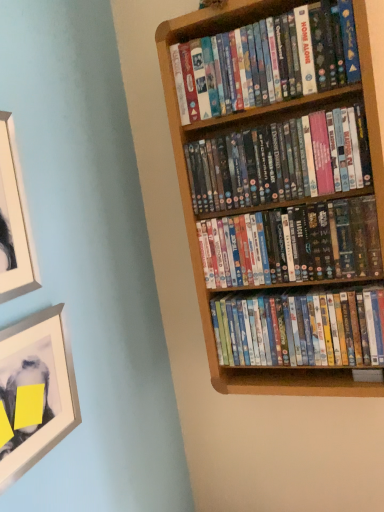
Question: Considering the relative positions of matte cardboard book at upper right, the 1th book from the top, and white matte picture frame at upper left, arranged as the second picture frame when ordered from the bottom, in the image provided, is matte cardboard book at upper right, the 1th book from the top, to the left of white matte picture frame at upper left, arranged as the second picture frame when ordered from the bottom, from the viewer's perspective?

Choices:
 (A) yes
 (B) no

Answer: (B)

Question: Is white matte picture frame at upper left, arranged as the second picture frame when ordered from the bottom, inside matte cardboard book at upper right, the 1th book from the top?

Choices:
 (A) no
 (B) yes

Answer: (A)

Question: Considering the relative sizes of matte cardboard book at upper right, the fourth book ordered from the bottom, and white matte picture frame at upper left, arranged as the second picture frame when ordered from the bottom, in the image provided, is matte cardboard book at upper right, the fourth book ordered from the bottom, bigger than white matte picture frame at upper left, arranged as the second picture frame when ordered from the bottom,?

Choices:
 (A) yes
 (B) no

Answer: (A)

Question: Is matte cardboard book at upper right, the 1th book from the top, located outside white matte picture frame at upper left, arranged as the second picture frame when ordered from the bottom?

Choices:
 (A) no
 (B) yes

Answer: (B)

Question: Would you say matte cardboard book at upper right, the 1th book from the top, is a long distance from white matte picture frame at upper left, arranged as the 1th picture frame when viewed from the top?

Choices:
 (A) no
 (B) yes

Answer: (A)

Question: From a real-world perspective, is multicolored plastic dvds at center, arranged as the fourth book when viewed from the top, positioned above or below white matte picture frame at upper left, arranged as the 1th picture frame when viewed from the top?

Choices:
 (A) above
 (B) below

Answer: (B)

Question: Considering the positions of multicolored plastic dvds at center, the first book when ordered from bottom to top, and white matte picture frame at upper left, arranged as the second picture frame when ordered from the bottom, in the image, is multicolored plastic dvds at center, the first book when ordered from bottom to top, taller or shorter than white matte picture frame at upper left, arranged as the second picture frame when ordered from the bottom,?

Choices:
 (A) tall
 (B) short

Answer: (B)

Question: In terms of width, does multicolored plastic dvds at center, arranged as the fourth book when viewed from the top, look wider or thinner when compared to white matte picture frame at upper left, arranged as the second picture frame when ordered from the bottom?

Choices:
 (A) wide
 (B) thin

Answer: (A)

Question: Is multicolored plastic dvds at center, arranged as the fourth book when viewed from the top, in front of or behind white matte picture frame at upper left, arranged as the second picture frame when ordered from the bottom, in the image?

Choices:
 (A) front
 (B) behind

Answer: (B)

Question: Visually, is white matte picture frame at upper left, arranged as the second picture frame when ordered from the bottom, positioned to the left or to the right of matte cardboard book at upper right, the 1th book from the top?

Choices:
 (A) left
 (B) right

Answer: (A)

Question: Considering the positions of point (1, 196) and point (266, 37), is point (1, 196) closer or farther from the camera than point (266, 37)?

Choices:
 (A) closer
 (B) farther

Answer: (A)

Question: Would you say white matte picture frame at upper left, arranged as the second picture frame when ordered from the bottom, is inside or outside matte cardboard book at upper right, the fourth book ordered from the bottom?

Choices:
 (A) inside
 (B) outside

Answer: (B)

Question: In the image, is white matte picture frame at upper left, arranged as the second picture frame when ordered from the bottom, positioned in front of or behind matte cardboard book at upper right, the fourth book ordered from the bottom?

Choices:
 (A) front
 (B) behind

Answer: (A)

Question: From a real-world perspective, relative to multicolored plastic dvds at center, arranged as the fourth book when viewed from the top, is white matte picture frame at upper left, arranged as the 1th picture frame when viewed from the top, vertically above or below?

Choices:
 (A) above
 (B) below

Answer: (A)

Question: Considering the positions of point (13, 237) and point (364, 356), is point (13, 237) closer or farther from the camera than point (364, 356)?

Choices:
 (A) farther
 (B) closer

Answer: (B)